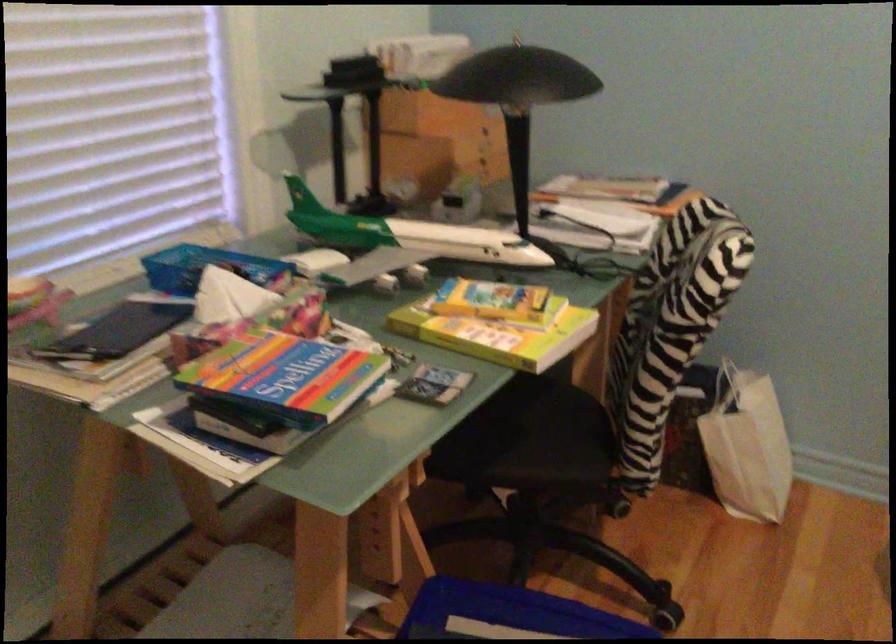
At what (x,y) coordinates should I click in order to perform the action: click on black lamp shade. Please return your answer as a coordinate pair (x, y). This screenshot has width=896, height=644. Looking at the image, I should click on (519, 158).